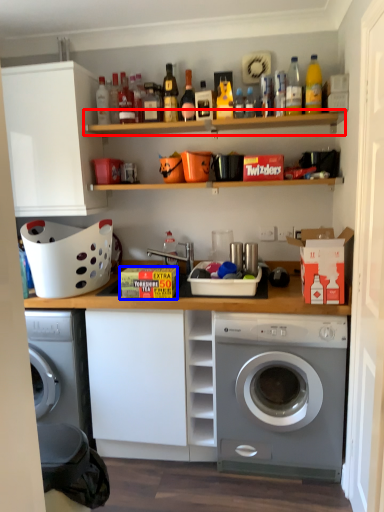
Question: Which object appears closest to the camera in this image, shelf (highlighted by a red box) or cardboard box (highlighted by a blue box)?

Choices:
 (A) shelf
 (B) cardboard box

Answer: (B)